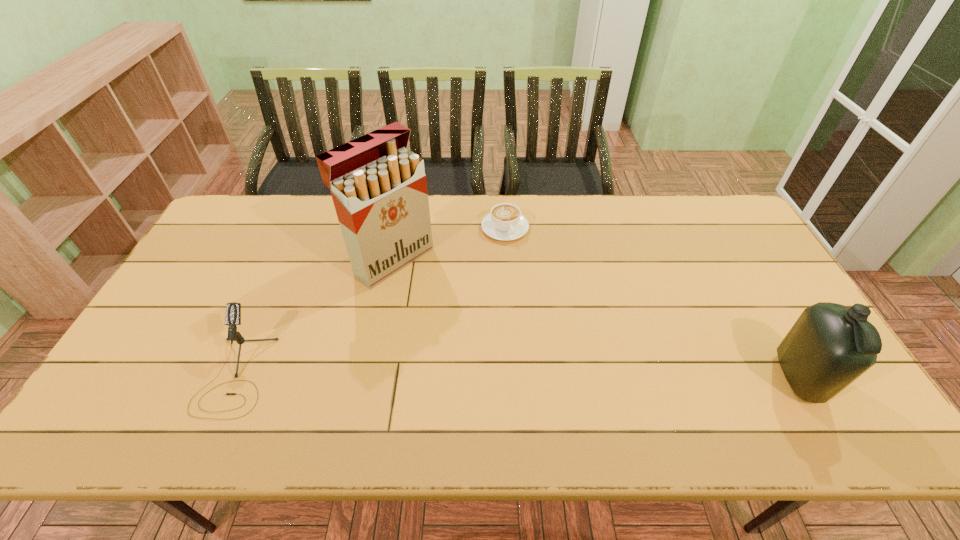
This screenshot has width=960, height=540. Identify the location of vacant point that satisfies the following two spatial constraints: 1. on the stand of the bottle; 2. on the left side of the leftmost object. coord(234,378).

In order to click on free location that satisfies the following two spatial constraints: 1. on the stand of the leftmost object; 2. on the right side of the bottle in this screenshot , I will do `click(234, 378)`.

The height and width of the screenshot is (540, 960). Find the location of `free spot that satisfies the following two spatial constraints: 1. on the back side of the second object from right to left; 2. on the right side of the cigarette case`. free spot that satisfies the following two spatial constraints: 1. on the back side of the second object from right to left; 2. on the right side of the cigarette case is located at coordinates click(398, 228).